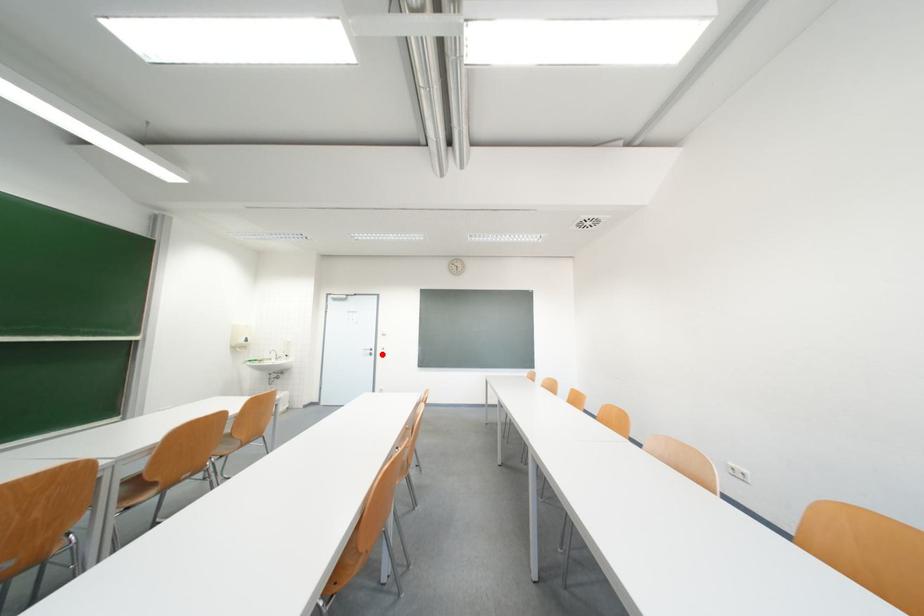
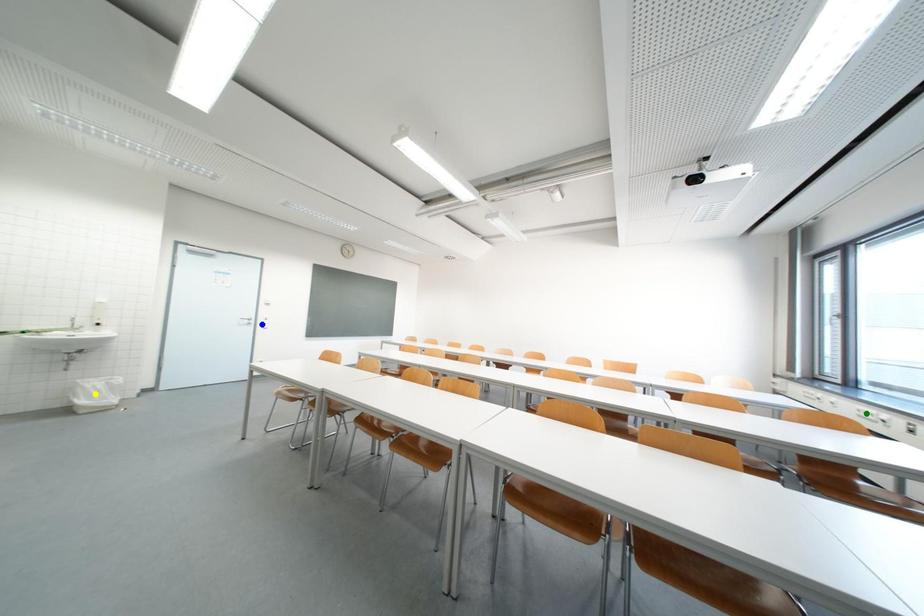
Question: I am providing you with two images of the same scene from different viewpoints. A red point is marked on the first image. You are given multiple points on the second image. Which point in image 2 is actually the same real-world point as the red point in image 1?

Choices:
 (A) blue point
 (B) yellow point
 (C) green point

Answer: (A)